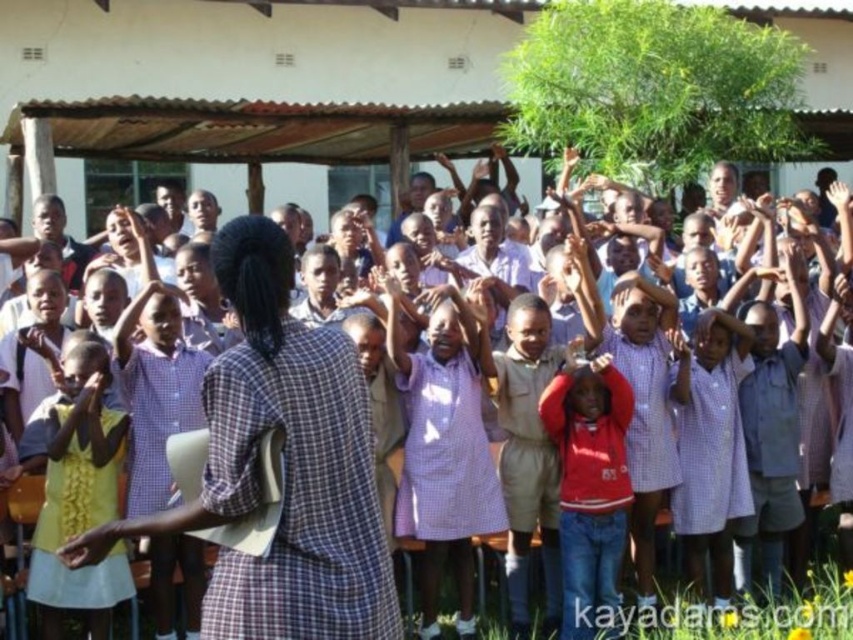
Question: Does yellow fabric dress at lower left appear under smooth skin hand at lower left?

Choices:
 (A) no
 (B) yes

Answer: (A)

Question: Is yellow fabric dress at lower left in front of yellow fabric hand at lower left?

Choices:
 (A) yes
 (B) no

Answer: (B)

Question: Which of the following is the closest to the observer?

Choices:
 (A) red fleece jacket at center
 (B) yellow fabric dress at lower left

Answer: (B)

Question: Estimate the real-world distances between objects in this image. Which object is closer to the smooth skin hand at lower left?

Choices:
 (A) yellow fabric dress at lower left
 (B) red fleece jacket at center

Answer: (A)

Question: Does yellow fabric dress at lower left have a larger size compared to red fleece jacket at center?

Choices:
 (A) yes
 (B) no

Answer: (A)

Question: Which point is closer to the camera taking this photo?

Choices:
 (A) (552, 417)
 (B) (90, 445)

Answer: (B)